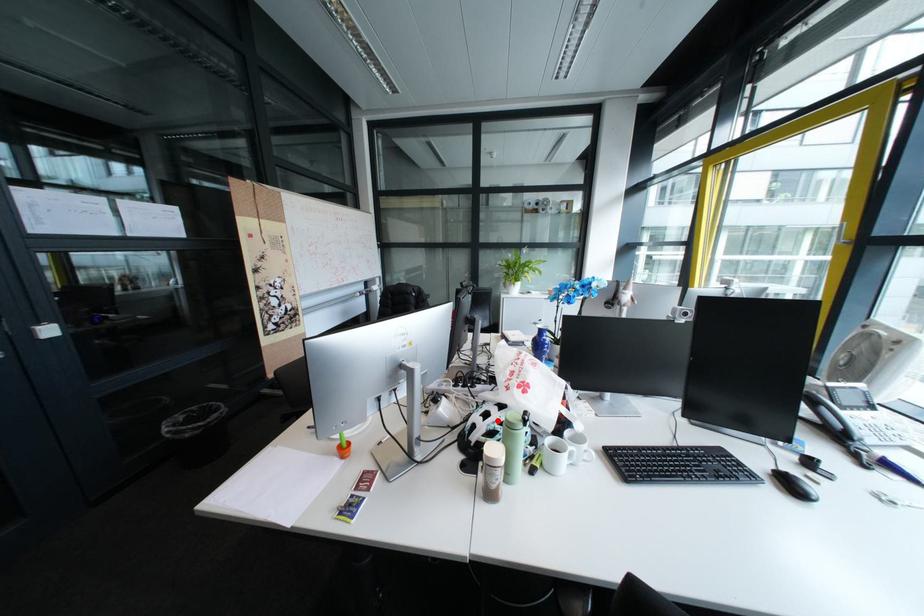
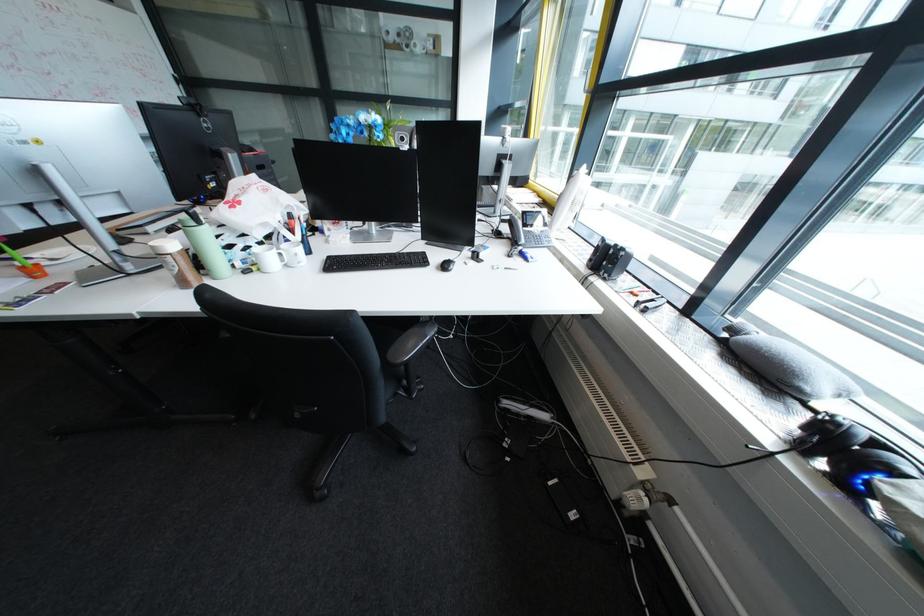
Question: I am providing you with two images of the same scene from different viewpoints. A red point is marked on the first image. Can you still see the location of the red point in image 2?

Choices:
 (A) Yes
 (B) No

Answer: (B)